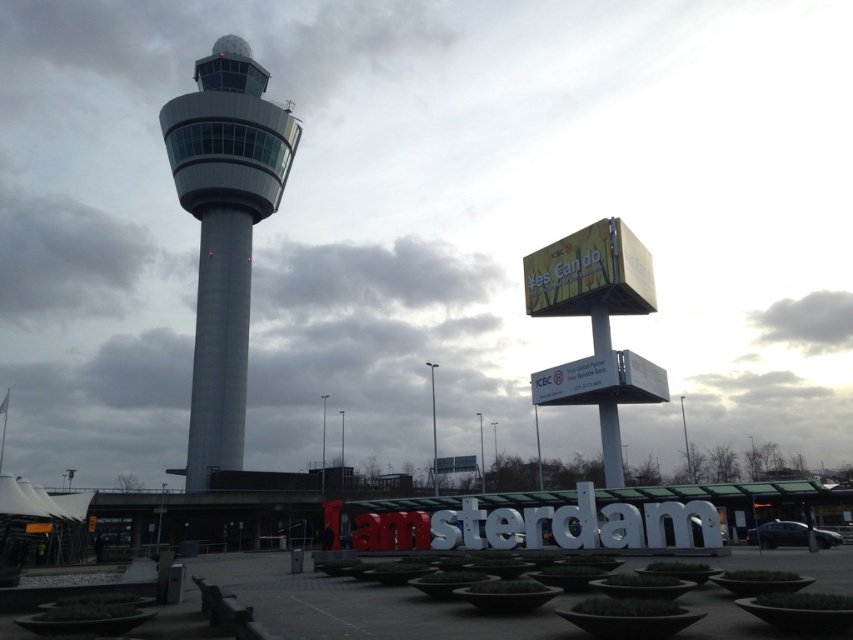
Is point (262, 109) closer to camera compared to point (634, 400)?

No, (262, 109) is behind (634, 400).

Describe the element at coordinates (224, 230) in the screenshot. I see `smooth gray tower at center` at that location.

In order to click on smooth gray tower at center in this screenshot , I will do `click(224, 230)`.

Can you confirm if yellow-green cardboard billboard at upper right is positioned to the left of white plastic sign at center?

Correct, you'll find yellow-green cardboard billboard at upper right to the left of white plastic sign at center.

Between yellow-green cardboard billboard at upper right and white plastic sign at center, which one is positioned lower?

white plastic sign at center is below.

Is point (605, 259) farther from camera compared to point (616, 356)?

Yes, it is behind point (616, 356).

Image resolution: width=853 pixels, height=640 pixels. In order to click on yellow-green cardboard billboard at upper right in this screenshot , I will do `click(590, 273)`.

Is smooth gray tower at center thinner than yellow-green cardboard billboard at upper right?

Incorrect, smooth gray tower at center's width is not less than yellow-green cardboard billboard at upper right's.

Is smooth gray tower at center to the left of yellow-green cardboard billboard at upper right from the viewer's perspective?

Correct, you'll find smooth gray tower at center to the left of yellow-green cardboard billboard at upper right.

Between point (210, 416) and point (555, 314), which one is positioned in front?

Point (555, 314) is in front.

Where is `smooth gray tower at center`? The image size is (853, 640). smooth gray tower at center is located at coordinates (224, 230).